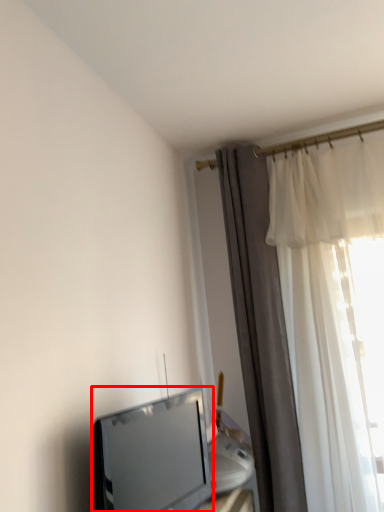
Question: From the image, what is the correct spatial relationship of television (annotated by the red box) in relation to curtain?

Choices:
 (A) left
 (B) right

Answer: (A)